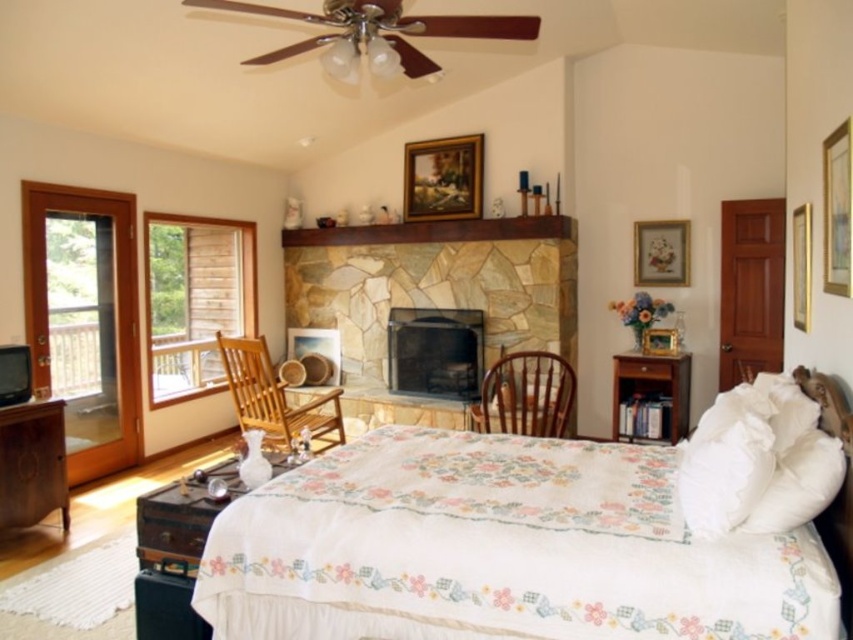
Between floral embroidered quilt at center and brown wood nightstand at lower right, which one has less height?

brown wood nightstand at lower right

Which is behind, point (463, 579) or point (663, 376)?

Positioned behind is point (663, 376).

Where is `floral embroidered quilt at center`? floral embroidered quilt at center is located at coordinates (500, 548).

Which is more to the right, floral embroidered quilt at center or wooden dresser at lower left?

Positioned to the right is floral embroidered quilt at center.

Who is taller, floral embroidered quilt at center or wooden dresser at lower left?

Standing taller between the two is floral embroidered quilt at center.

Is point (242, 540) more distant than point (50, 401)?

No.

This screenshot has width=853, height=640. Find the location of `floral embroidered quilt at center`. floral embroidered quilt at center is located at coordinates (500, 548).

The image size is (853, 640). What do you see at coordinates (434, 352) in the screenshot?
I see `matte stone fireplace at center` at bounding box center [434, 352].

Can you confirm if matte stone fireplace at center is bigger than wooden dresser at lower left?

Yes, matte stone fireplace at center is bigger than wooden dresser at lower left.

Who is more distant from viewer, [473,346] or [22,499]?

The point [473,346] is more distant.

The image size is (853, 640). In order to click on matte stone fireplace at center in this screenshot , I will do `click(434, 352)`.